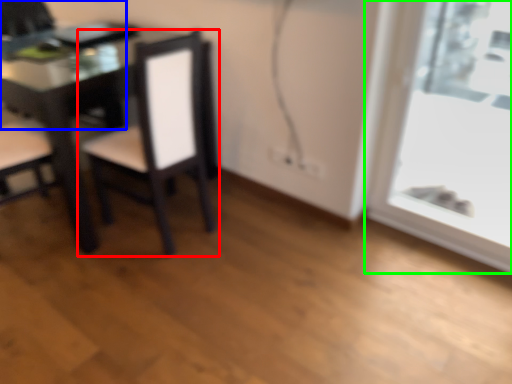
Question: Which is farther away from chair (highlighted by a red box)? chair (highlighted by a blue box) or window (highlighted by a green box)?

Choices:
 (A) chair
 (B) window

Answer: (B)